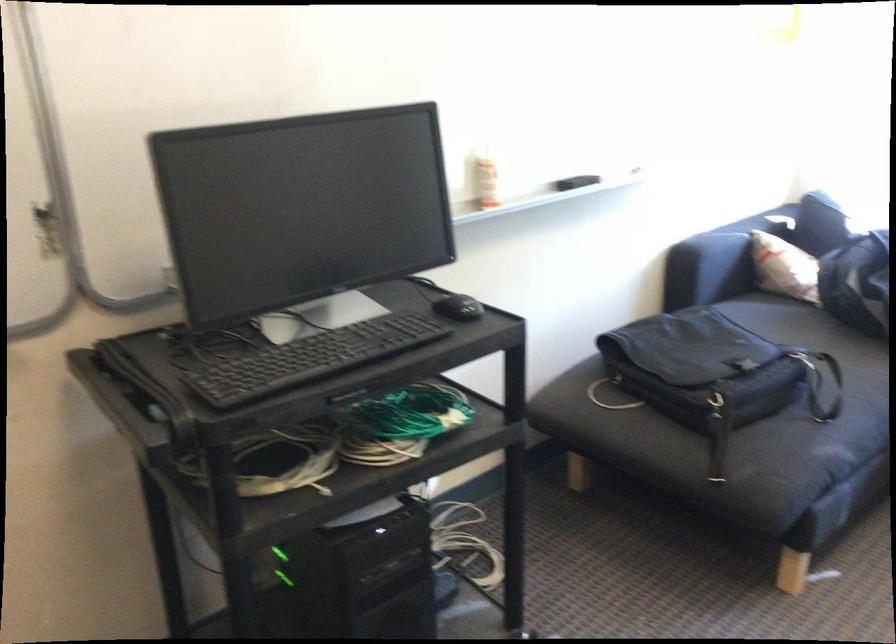
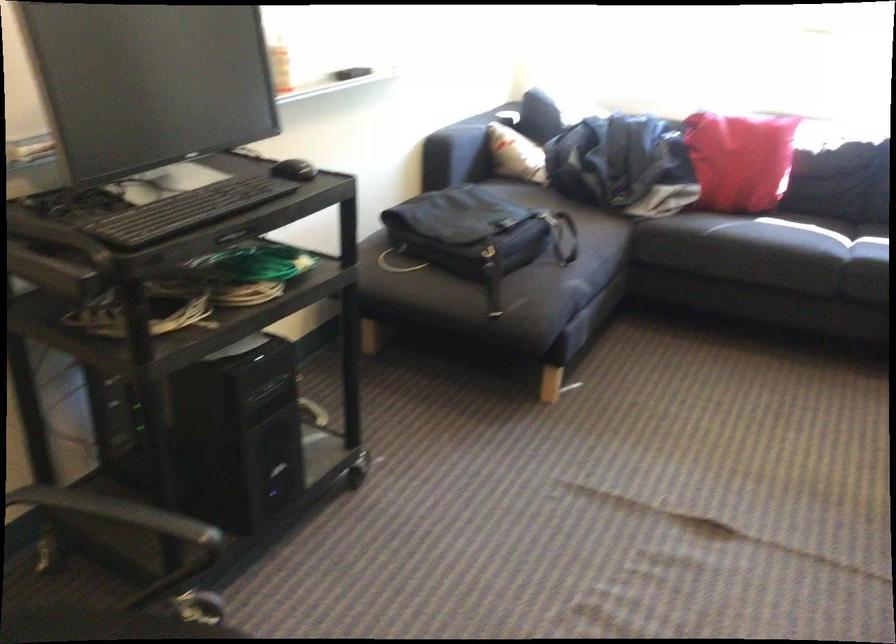
Question: The camera is either moving clockwise (left) or counter-clockwise (right) around the object. The first image is from the beginning of the video and the second image is from the end. Is the camera moving left or right when shooting the video?

Choices:
 (A) Left
 (B) Right

Answer: (A)